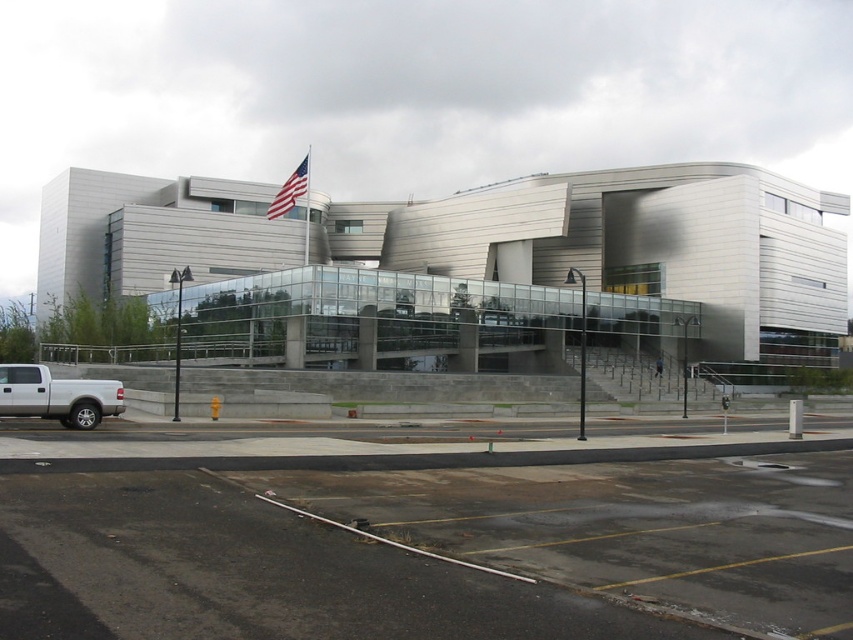
Question: Can you confirm if dark asphalt parking lot at lower center is positioned below american flag at upper center?

Choices:
 (A) yes
 (B) no

Answer: (A)

Question: Does dark asphalt parking lot at lower center have a greater width compared to american flag at upper center?

Choices:
 (A) no
 (B) yes

Answer: (A)

Question: Is the position of dark asphalt parking lot at lower center more distant than that of american flag at upper center?

Choices:
 (A) no
 (B) yes

Answer: (A)

Question: Which object is closer to the camera taking this photo?

Choices:
 (A) white matte truck at lower left
 (B) american flag at upper center

Answer: (A)

Question: Among these objects, which one is farthest from the camera?

Choices:
 (A) american flag at upper center
 (B) dark asphalt parking lot at lower center

Answer: (A)

Question: Estimate the real-world distances between objects in this image. Which object is farther from the dark asphalt parking lot at lower center?

Choices:
 (A) white matte truck at lower left
 (B) american flag at upper center

Answer: (B)